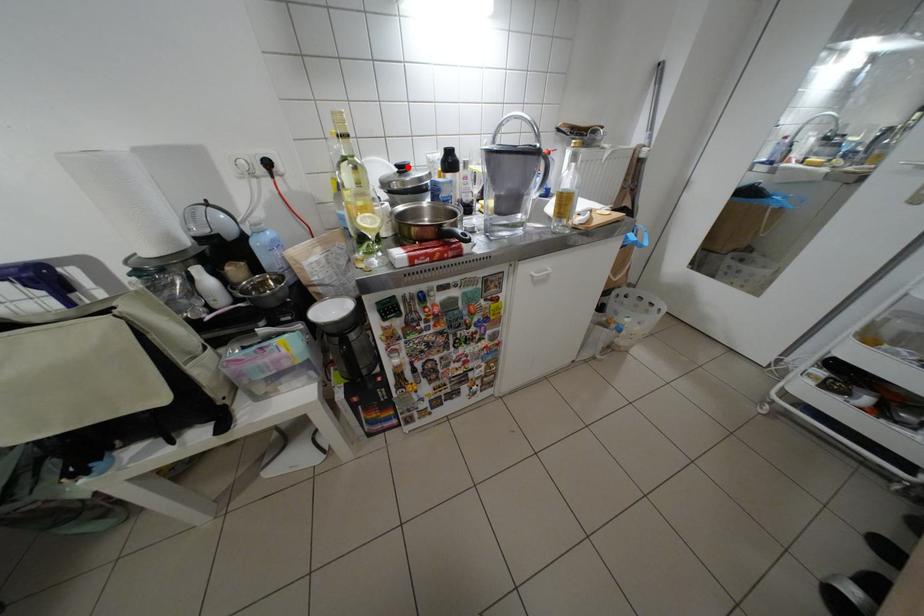
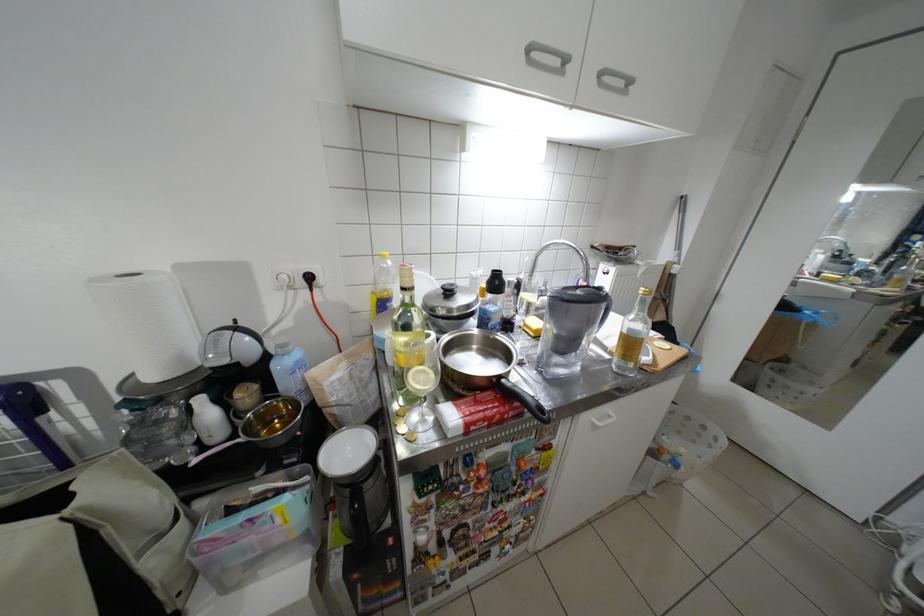
Locate, in the second image, the point that corresponds to the highlighted location in the first image.

(455, 290)